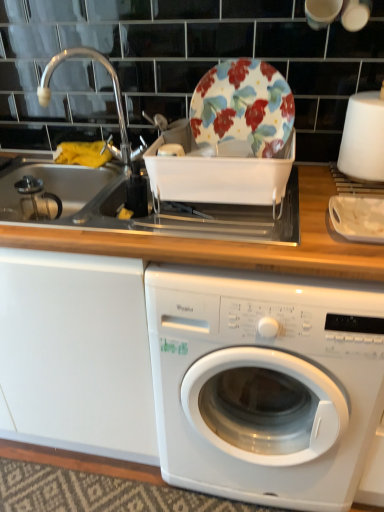
Question: Can you confirm if floral-patterned ceramic plate at upper center is taller than white plastic container at right?

Choices:
 (A) yes
 (B) no

Answer: (A)

Question: Is floral-patterned ceramic plate at upper center facing away from white plastic container at right?

Choices:
 (A) yes
 (B) no

Answer: (B)

Question: Are floral-patterned ceramic plate at upper center and white plastic container at right beside each other?

Choices:
 (A) no
 (B) yes

Answer: (A)

Question: Is floral-patterned ceramic plate at upper center not within white plastic container at right?

Choices:
 (A) yes
 (B) no

Answer: (A)

Question: Is floral-patterned ceramic plate at upper center positioned far away from white plastic container at right?

Choices:
 (A) no
 (B) yes

Answer: (A)

Question: Relative to floral-patterned ceramic plate at upper center, is brushed metal sink at left in front or behind?

Choices:
 (A) behind
 (B) front

Answer: (A)

Question: Considering the positions of brushed metal sink at left and floral-patterned ceramic plate at upper center in the image, is brushed metal sink at left wider or thinner than floral-patterned ceramic plate at upper center?

Choices:
 (A) wide
 (B) thin

Answer: (A)

Question: Based on their sizes in the image, would you say brushed metal sink at left is bigger or smaller than floral-patterned ceramic plate at upper center?

Choices:
 (A) big
 (B) small

Answer: (A)

Question: From a real-world perspective, is brushed metal sink at left physically located above or below floral-patterned ceramic plate at upper center?

Choices:
 (A) above
 (B) below

Answer: (B)

Question: In terms of width, does floral-patterned ceramic plate at upper center look wider or thinner when compared to white plastic container at right?

Choices:
 (A) thin
 (B) wide

Answer: (A)

Question: Based on their positions, is floral-patterned ceramic plate at upper center located to the left or right of white plastic container at right?

Choices:
 (A) right
 (B) left

Answer: (B)

Question: From the image's perspective, is floral-patterned ceramic plate at upper center above or below white plastic container at right?

Choices:
 (A) below
 (B) above

Answer: (B)

Question: Would you say floral-patterned ceramic plate at upper center is inside or outside white plastic container at right?

Choices:
 (A) inside
 (B) outside

Answer: (B)

Question: Considering the positions of white glossy washing machine at center and floral-patterned ceramic plate at upper center in the image, is white glossy washing machine at center wider or thinner than floral-patterned ceramic plate at upper center?

Choices:
 (A) wide
 (B) thin

Answer: (A)

Question: From the image's perspective, relative to floral-patterned ceramic plate at upper center, is white glossy washing machine at center above or below?

Choices:
 (A) below
 (B) above

Answer: (A)